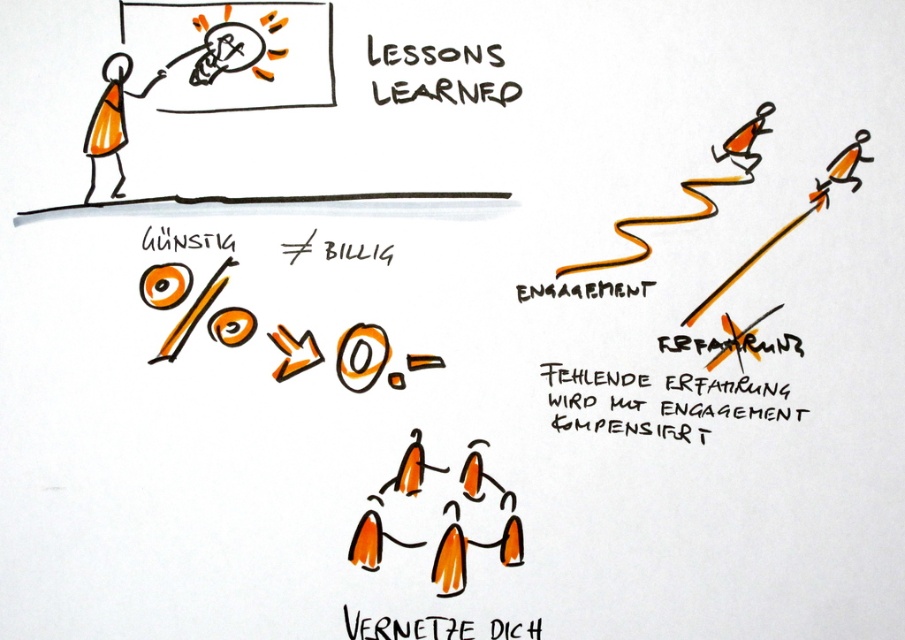
Which is below, brown handwritten text at upper center or black paper text at lower center?

black paper text at lower center is lower down.

What do you see at coordinates (437, 74) in the screenshot? This screenshot has width=905, height=640. I see `brown handwritten text at upper center` at bounding box center [437, 74].

In order to click on brown handwritten text at upper center in this screenshot , I will do `click(437, 74)`.

From the picture: Does orange paper man at upper left appear over orange matte stick figure at upper right?

Indeed, orange paper man at upper left is positioned over orange matte stick figure at upper right.

Can you confirm if orange paper man at upper left is positioned below orange matte stick figure at upper right?

Actually, orange paper man at upper left is above orange matte stick figure at upper right.

Measure the distance between point [102,115] and camera.

A distance of 1.06 meters exists between point [102,115] and camera.

Find the location of a particular element. Image resolution: width=905 pixels, height=640 pixels. orange paper man at upper left is located at coordinates (108, 122).

Is brown handwritten text at upper center closer to the viewer compared to orange paper man at upper left?

That is True.

Is brown handwritten text at upper center to the right of orange paper man at upper left from the viewer's perspective?

Correct, you'll find brown handwritten text at upper center to the right of orange paper man at upper left.

Does point (444, 67) come in front of point (122, 195)?

That is True.

Where is `brown handwritten text at upper center`? This screenshot has width=905, height=640. brown handwritten text at upper center is located at coordinates (437, 74).